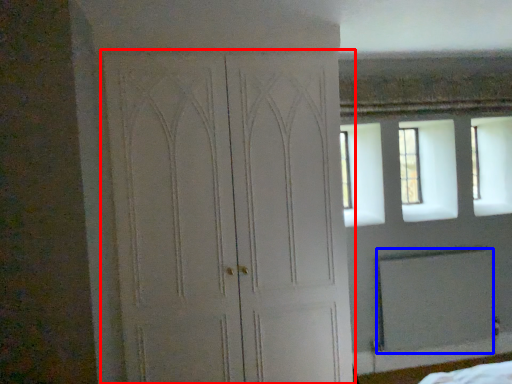
Question: Which object is closer to the camera taking this photo, door (highlighted by a red box) or screen door (highlighted by a blue box)?

Choices:
 (A) door
 (B) screen door

Answer: (A)